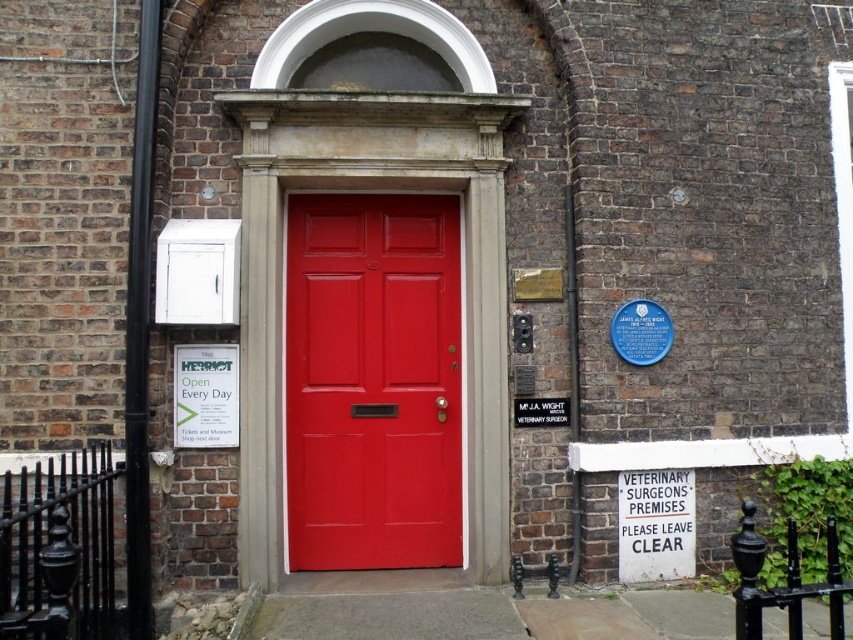
Is matte red door at center shorter than white paper sign at center?

No, matte red door at center is not shorter than white paper sign at center.

In the scene shown: How much distance is there between matte red door at center and white paper sign at center?

65.58 centimeters

Find the location of a particular element. The image size is (853, 640). matte red door at center is located at coordinates (372, 381).